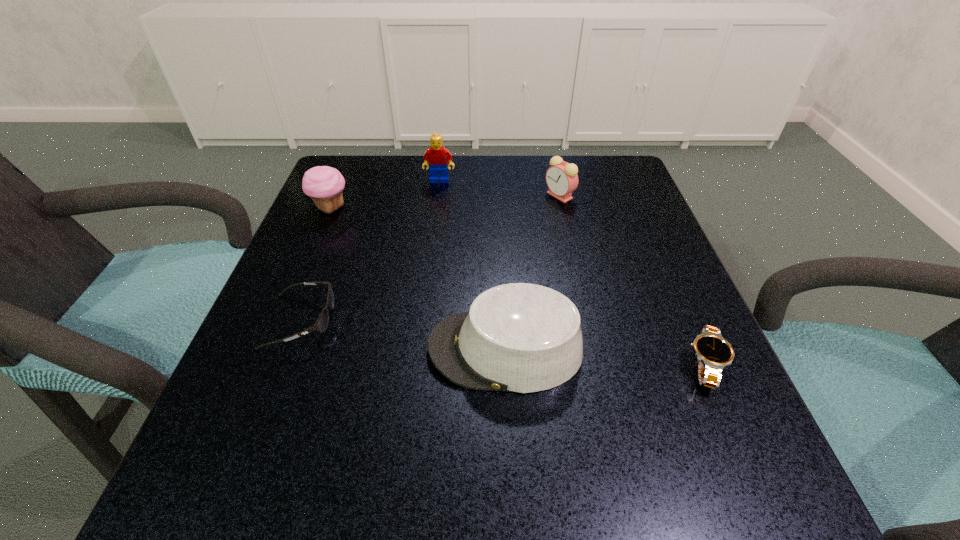
You are a GUI agent. You are given a task and a screenshot of the screen. Output one action in this format:
    pyautogui.click(x=<x>, y=<y>)
    Task: Click on the tallest object
    This screenshot has width=960, height=540.
    Given the screenshot: What is the action you would take?
    pyautogui.click(x=438, y=156)

Locate an element on the screen. the farthest object is located at coordinates (438, 156).

Locate an element on the screen. The image size is (960, 540). cupcake is located at coordinates (324, 184).

This screenshot has height=540, width=960. In order to click on alarm clock in this screenshot , I will do (562, 179).

At what (x,y) coordinates should I click in order to perform the action: click on hat. Please return your answer as a coordinate pair (x, y). The width and height of the screenshot is (960, 540). Looking at the image, I should click on (519, 337).

At what (x,y) coordinates should I click in order to perform the action: click on the fifth tallest object. Please return your answer as a coordinate pair (x, y). Image resolution: width=960 pixels, height=540 pixels. Looking at the image, I should click on (321, 324).

Locate an element on the screen. The image size is (960, 540). watch is located at coordinates (714, 353).

Locate an element on the screen. The image size is (960, 540). the rightmost object is located at coordinates (714, 353).

I want to click on free region located 0.320m on the front-facing side of the Lego, so click(x=427, y=279).

Identify the location of blank space located 0.350m on the right of the cupcake. This screenshot has height=540, width=960. (510, 208).